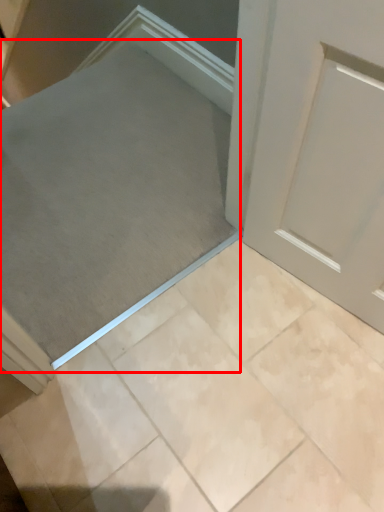
Question: Observing the image, what is the correct spatial positioning of ramp (annotated by the red box) in reference to ceramic tile?

Choices:
 (A) left
 (B) right

Answer: (A)